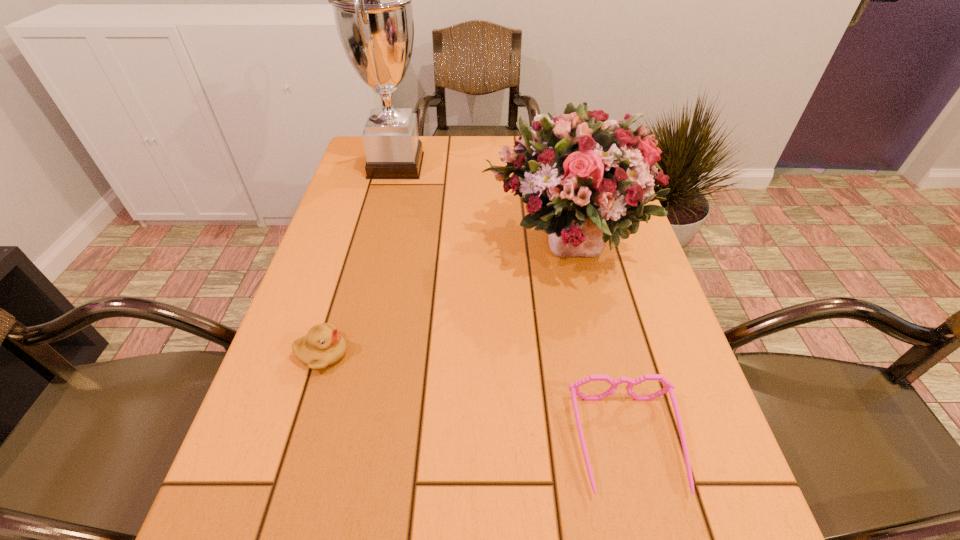
In order to click on trophy cup that is at the far edge in this screenshot , I will do `click(371, 0)`.

Locate an element on the screen. The image size is (960, 540). beer can situated at the far edge is located at coordinates (537, 118).

Locate an element on the screen. trophy cup at the left edge is located at coordinates (371, 0).

Image resolution: width=960 pixels, height=540 pixels. Identify the location of duckling situated at the left edge. (323, 346).

Find the location of a particular element. The height and width of the screenshot is (540, 960). bouquet located in the right edge section of the desktop is located at coordinates (585, 180).

Where is `spectacles that is at the right edge`? Image resolution: width=960 pixels, height=540 pixels. spectacles that is at the right edge is located at coordinates (668, 387).

I want to click on object positioned at the far left corner, so click(x=371, y=0).

Where is `free space at the left edge of the desktop`? free space at the left edge of the desktop is located at coordinates (373, 268).

The image size is (960, 540). I want to click on free space at the right edge of the desktop, so click(636, 307).

Image resolution: width=960 pixels, height=540 pixels. I want to click on free space between the third tallest object and the duckling, so click(x=432, y=256).